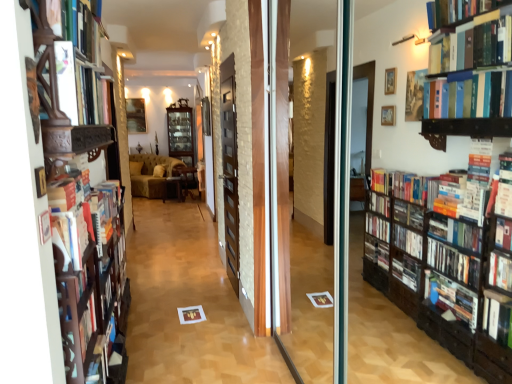
You are a GUI agent. You are given a task and a screenshot of the screen. Output one action in this format:
    pyautogui.click(x=<x>, y=<y>)
    Task: Click on the vacant area that lies in front of matte brown paper at center
    The image size is (512, 384).
    Given the screenshot: What is the action you would take?
    pyautogui.click(x=194, y=328)